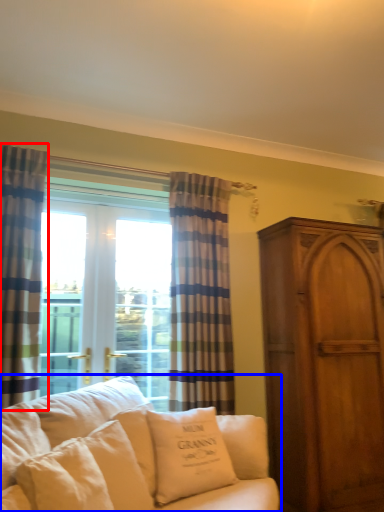
Question: Which of the following is the closest to the observer, curtain (highlighted by a red box) or studio couch (highlighted by a blue box)?

Choices:
 (A) curtain
 (B) studio couch

Answer: (B)